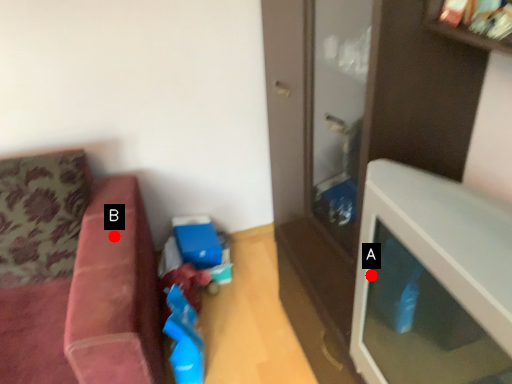
Question: Two points are circled on the image, labeled by A and B beside each circle. Which point appears closest to the camera in this image?

Choices:
 (A) A is closer
 (B) B is closer

Answer: (A)